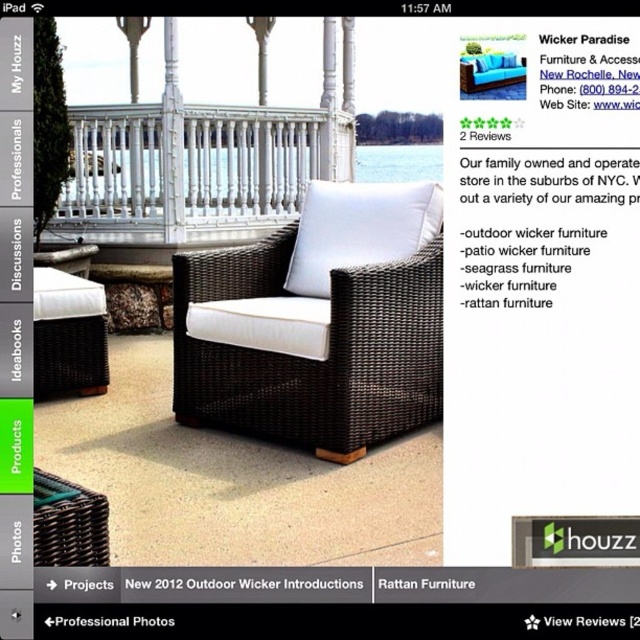
Question: Does white wicker railing at upper center appear over matte wicker chair at center?

Choices:
 (A) no
 (B) yes

Answer: (B)

Question: Does white matte pillow at center have a greater width compared to white wicker chair at center?

Choices:
 (A) no
 (B) yes

Answer: (B)

Question: Which is nearer to the white matte pillow at center?

Choices:
 (A) brown wicker armchair at center
 (B) white wicker railing at upper center
 (C) white wicker chair at center
 (D) rattan furniture at center

Answer: (A)

Question: Does white wicker chair at center have a greater width compared to rattan furniture at center?

Choices:
 (A) yes
 (B) no

Answer: (A)

Question: Which object appears farthest from the camera in this image?

Choices:
 (A) white wicker chair at center
 (B) rattan furniture at center
 (C) white matte pillow at center
 (D) brown wicker armchair at center

Answer: (C)

Question: Which point is closer to the camera?

Choices:
 (A) (177, 204)
 (B) (404, 202)

Answer: (B)